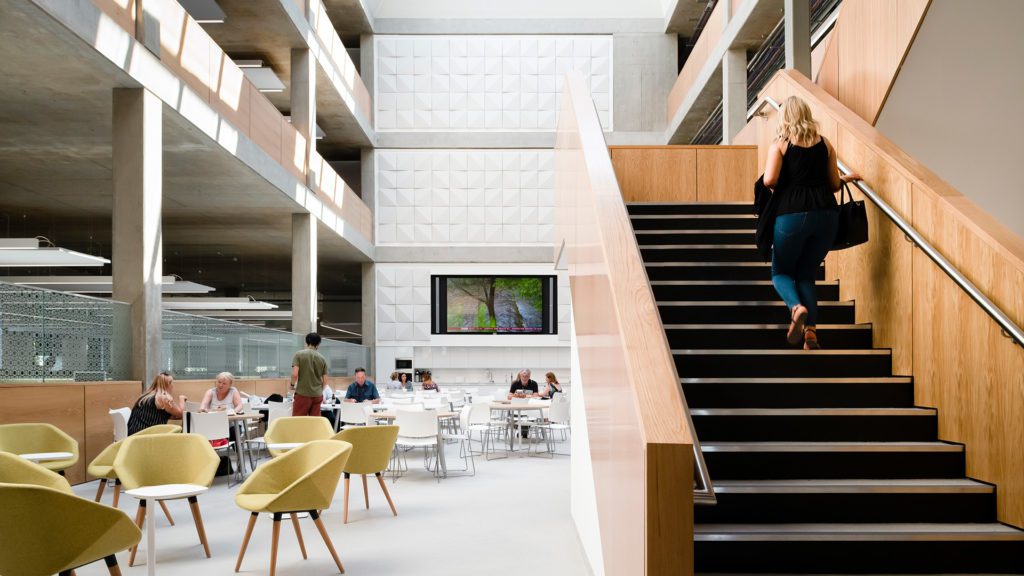
I want to click on yellow chairs, so click(306, 485), click(194, 458), click(59, 521), click(28, 431), click(94, 456), click(305, 432), click(368, 445).